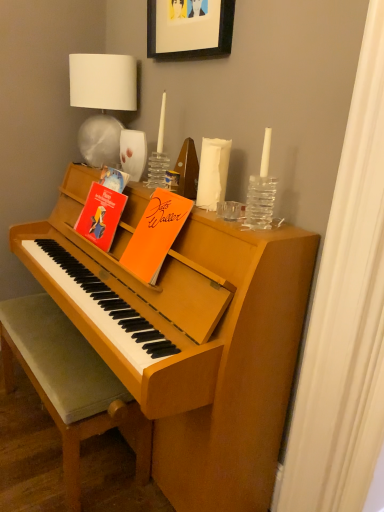
Where is `free location above velvet grey cushioned bench at lower left (from a real-world perspective)`? free location above velvet grey cushioned bench at lower left (from a real-world perspective) is located at coordinates (57, 333).